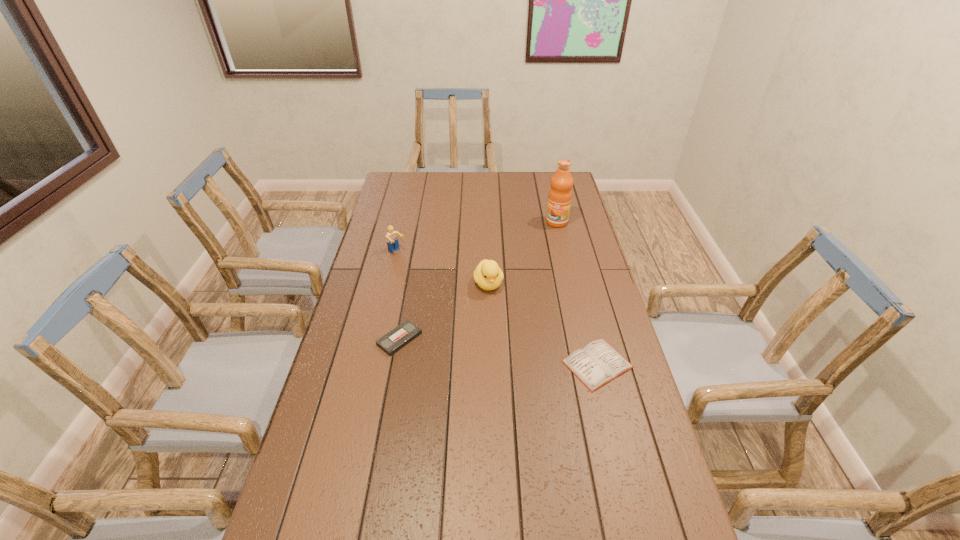
Identify the location of videotape. The height and width of the screenshot is (540, 960). (397, 338).

The width and height of the screenshot is (960, 540). What are the coordinates of `diary` in the screenshot? It's located at (598, 363).

You are a GUI agent. You are given a task and a screenshot of the screen. Output one action in this format:
    pyautogui.click(x=<x>, y=<y>)
    Task: Click on the duck
    
    Given the screenshot: What is the action you would take?
    pyautogui.click(x=488, y=276)

At what (x,y) coordinates should I click in order to perform the action: click on the third object from left to right. Please return your answer as a coordinate pair (x, y). Looking at the image, I should click on (488, 276).

This screenshot has height=540, width=960. In order to click on the fourth nearest object in this screenshot , I will do `click(391, 237)`.

Where is `fruit juice`? The image size is (960, 540). fruit juice is located at coordinates (559, 200).

The height and width of the screenshot is (540, 960). Identify the location of the farthest object. (559, 200).

You are a GUI agent. You are given a task and a screenshot of the screen. Output one action in this format:
    pyautogui.click(x=<x>, y=<y>)
    Task: Click on the vacant space located 0.180m on the back of the videotape
    This screenshot has width=960, height=540.
    Given the screenshot: What is the action you would take?
    pyautogui.click(x=409, y=286)

Where is `vacant space located 0.060m on the back of the diary`? The image size is (960, 540). vacant space located 0.060m on the back of the diary is located at coordinates (588, 324).

Where is `free region located 0.230m on the front-facing side of the third nearest object`? Image resolution: width=960 pixels, height=540 pixels. free region located 0.230m on the front-facing side of the third nearest object is located at coordinates (512, 346).